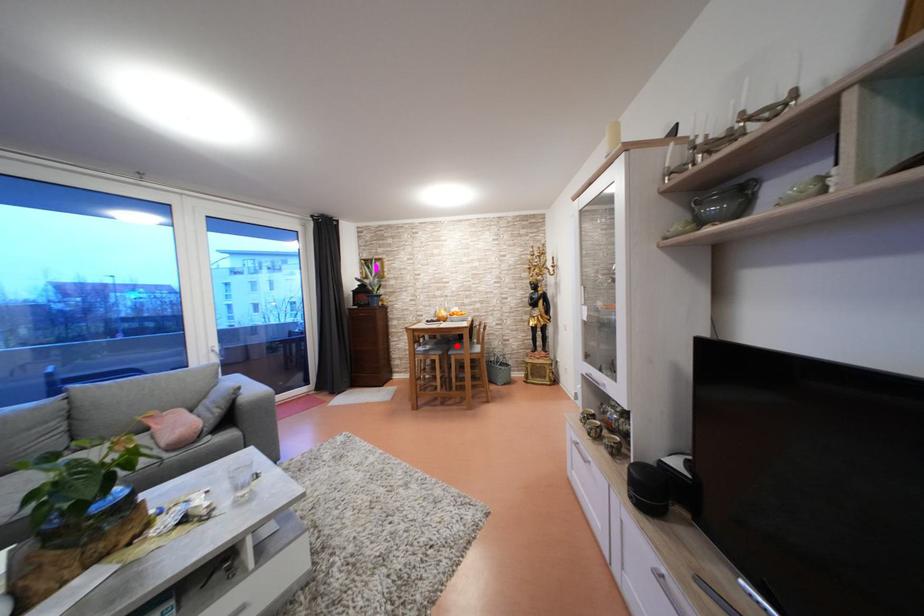
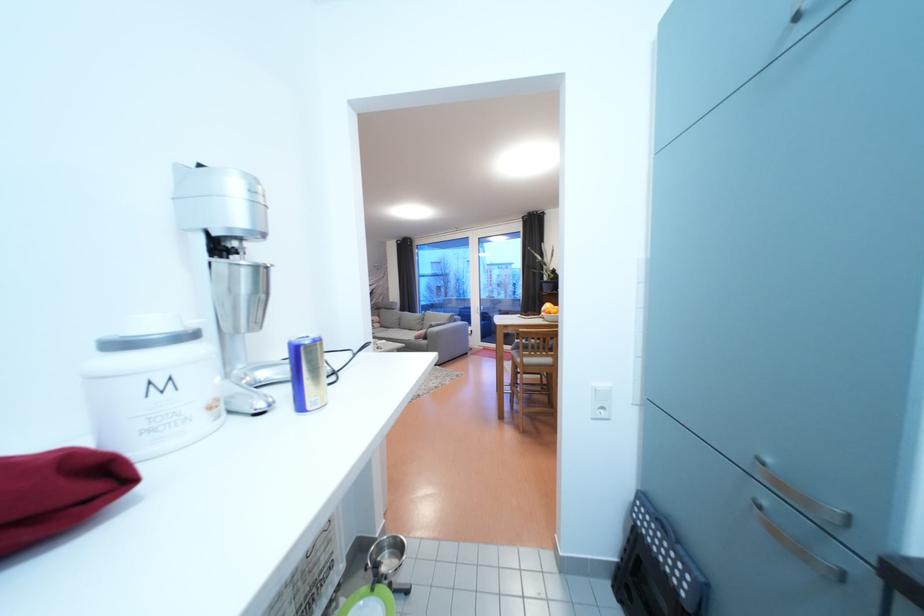
Question: I am providing you with two images of the same scene from different viewpoints. A red point is marked on the first image. At the location where the point appears in image 1, is it still visible in image 2?

Choices:
 (A) Yes
 (B) No

Answer: (B)